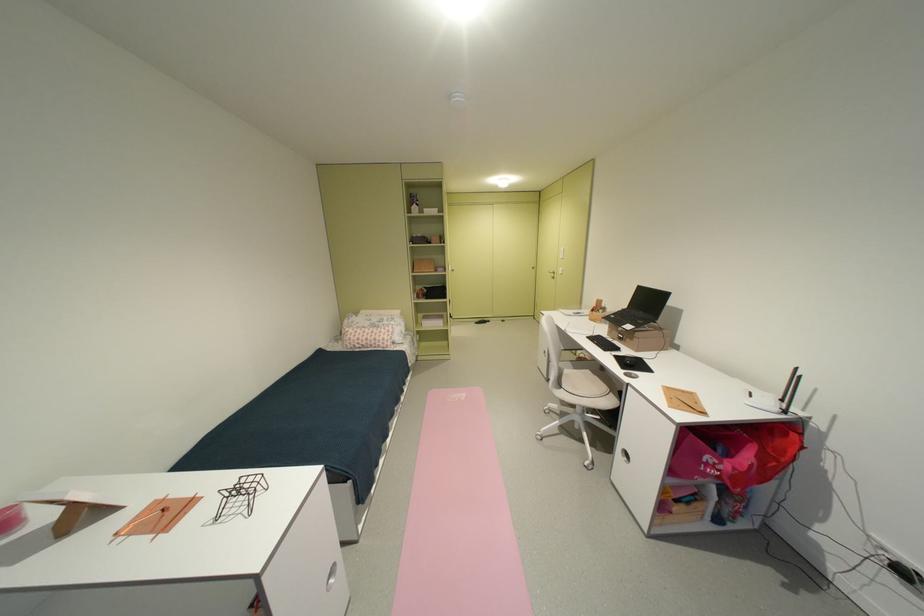
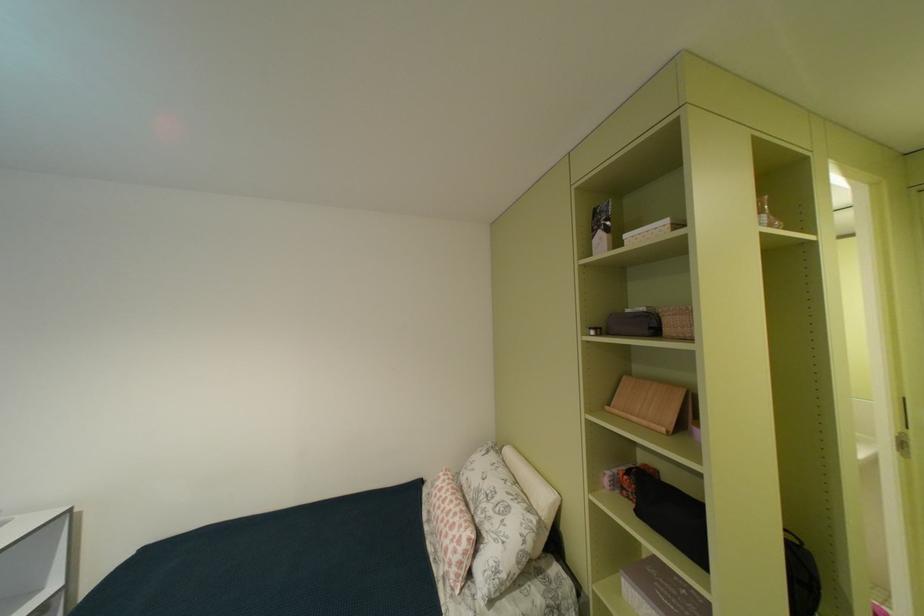
Locate, in the second image, the point that corresponds to [379,325] in the first image.

(487, 487)